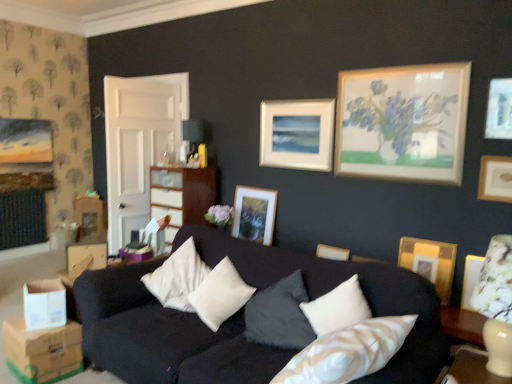
Question: From the image's perspective, is white soft cushion at center below white cardboard box at lower left, the second cardboard box ordered from the bottom?

Choices:
 (A) no
 (B) yes

Answer: (A)

Question: Does white soft cushion at center lie behind white cardboard box at lower left, positioned as the first cardboard box in top-to-bottom order?

Choices:
 (A) yes
 (B) no

Answer: (B)

Question: Considering the relative positions of white soft cushion at center and white cardboard box at lower left, positioned as the first cardboard box in top-to-bottom order, in the image provided, is white soft cushion at center to the left of white cardboard box at lower left, positioned as the first cardboard box in top-to-bottom order, from the viewer's perspective?

Choices:
 (A) no
 (B) yes

Answer: (A)

Question: Is white soft cushion at center smaller than white cardboard box at lower left, the second cardboard box ordered from the bottom?

Choices:
 (A) yes
 (B) no

Answer: (B)

Question: Is white soft cushion at center facing away from white cardboard box at lower left, positioned as the first cardboard box in top-to-bottom order?

Choices:
 (A) no
 (B) yes

Answer: (A)

Question: Does white soft cushion at center turn towards white cardboard box at lower left, the second cardboard box ordered from the bottom?

Choices:
 (A) no
 (B) yes

Answer: (A)

Question: Considering the relative positions of white cardboard box at lower left, the second cardboard box ordered from the bottom, and wooden picture frame at upper right, marked as the first picture frame in a front-to-back arrangement, in the image provided, is white cardboard box at lower left, the second cardboard box ordered from the bottom, to the right of wooden picture frame at upper right, marked as the first picture frame in a front-to-back arrangement, from the viewer's perspective?

Choices:
 (A) no
 (B) yes

Answer: (A)

Question: Is white cardboard box at lower left, positioned as the first cardboard box in top-to-bottom order, at the left side of wooden picture frame at upper right, acting as the 4th picture frame starting from the back?

Choices:
 (A) yes
 (B) no

Answer: (A)

Question: Considering the relative sizes of white cardboard box at lower left, the second cardboard box ordered from the bottom, and wooden picture frame at upper right, the fourth picture frame positioned from the left, in the image provided, is white cardboard box at lower left, the second cardboard box ordered from the bottom, thinner than wooden picture frame at upper right, the fourth picture frame positioned from the left,?

Choices:
 (A) yes
 (B) no

Answer: (B)

Question: Would you say white cardboard box at lower left, the second cardboard box ordered from the bottom, contains wooden picture frame at upper right, acting as the 4th picture frame starting from the back?

Choices:
 (A) yes
 (B) no

Answer: (B)

Question: Can you confirm if white cardboard box at lower left, positioned as the first cardboard box in top-to-bottom order, is wider than wooden picture frame at upper right, acting as the 4th picture frame starting from the back?

Choices:
 (A) yes
 (B) no

Answer: (A)

Question: From the image's perspective, is white cardboard box at lower left, positioned as the first cardboard box in top-to-bottom order, located beneath wooden picture frame at upper right, marked as the first picture frame in a front-to-back arrangement?

Choices:
 (A) no
 (B) yes

Answer: (B)

Question: Is matte gold picture frame at center, marked as the 4th picture frame in a front-to-back arrangement, next to wooden picture frame at upper right, acting as the 4th picture frame starting from the back?

Choices:
 (A) yes
 (B) no

Answer: (B)